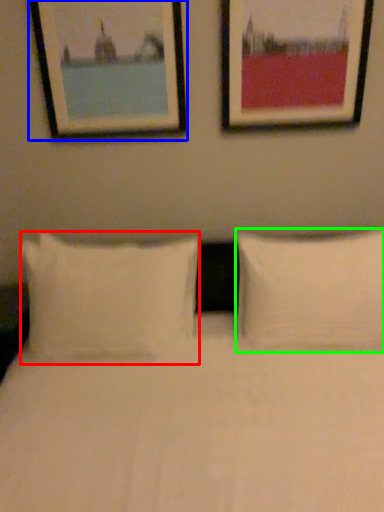
Question: Based on their relative distances, which object is farther from pillow (highlighted by a red box)? Choose from picture frame (highlighted by a blue box) and pillow (highlighted by a green box).

Choices:
 (A) picture frame
 (B) pillow

Answer: (A)